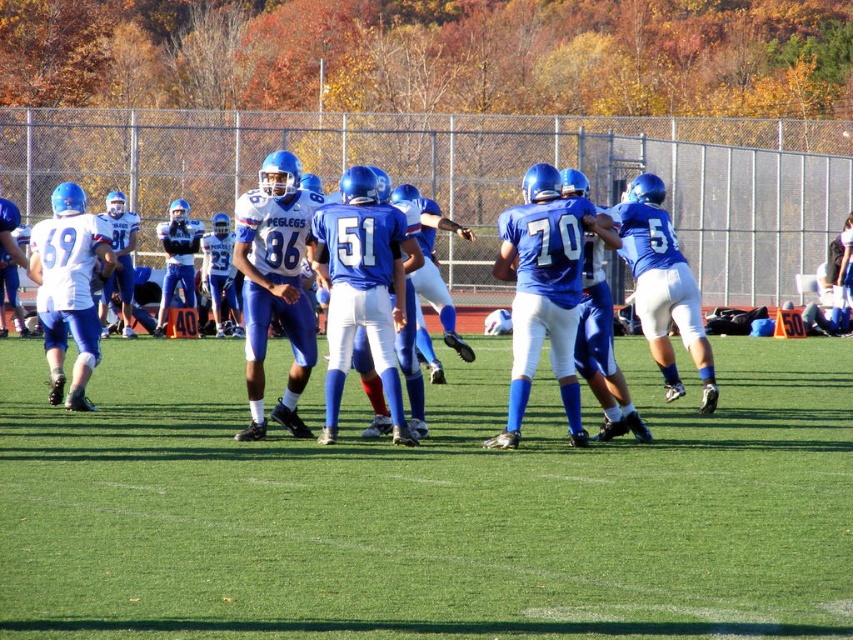
Question: Does green artificial turf at center appear under blue matte uniform at center?

Choices:
 (A) no
 (B) yes

Answer: (B)

Question: Which point is closer to the camera taking this photo?

Choices:
 (A) (13, 548)
 (B) (328, 244)

Answer: (A)

Question: Can you confirm if green artificial turf at center is smaller than blue matte uniform at center?

Choices:
 (A) yes
 (B) no

Answer: (B)

Question: Where is green artificial turf at center located in relation to blue matte uniform at center in the image?

Choices:
 (A) right
 (B) left

Answer: (B)